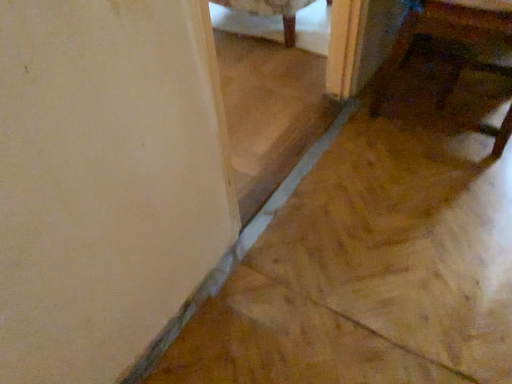
The image size is (512, 384). I want to click on free spot below wooden table at lower right (from a real-world perspective), so click(445, 101).